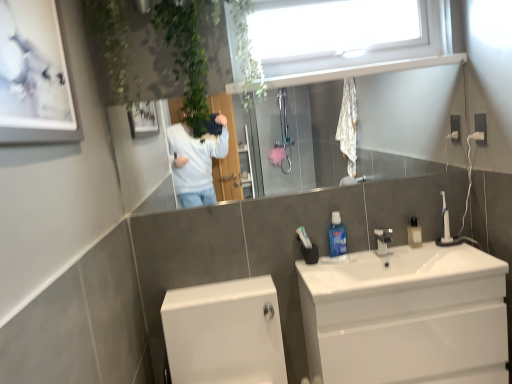
Question: From their relative heights in the image, would you say glossy glass mirror at upper center is taller or shorter than white glossy toilet at lower left?

Choices:
 (A) tall
 (B) short

Answer: (B)

Question: From the image's perspective, relative to white glossy toilet at lower left, is glossy glass mirror at upper center above or below?

Choices:
 (A) below
 (B) above

Answer: (B)

Question: Which of these objects is positioned closest to the white plastic window at upper center?

Choices:
 (A) white glossy picture frame at upper left
 (B) translucent plastic mouthwash at sink right, arranged as the 2th mouthwash when viewed from the left
 (C) white glossy toilet at lower left
 (D) white glossy sink at center
 (E) blue plastic mouthwash at center, positioned as the 2th mouthwash in right-to-left order

Answer: (E)

Question: Which of these objects is positioned closest to the blue plastic mouthwash at center, positioned as the 2th mouthwash in right-to-left order?

Choices:
 (A) glossy glass mirror at upper center
 (B) white glossy sink at center
 (C) translucent plastic mouthwash at sink right, the 1th mouthwash positioned from the right
 (D) white glossy picture frame at upper left
 (E) white glossy toilet at lower left

Answer: (B)